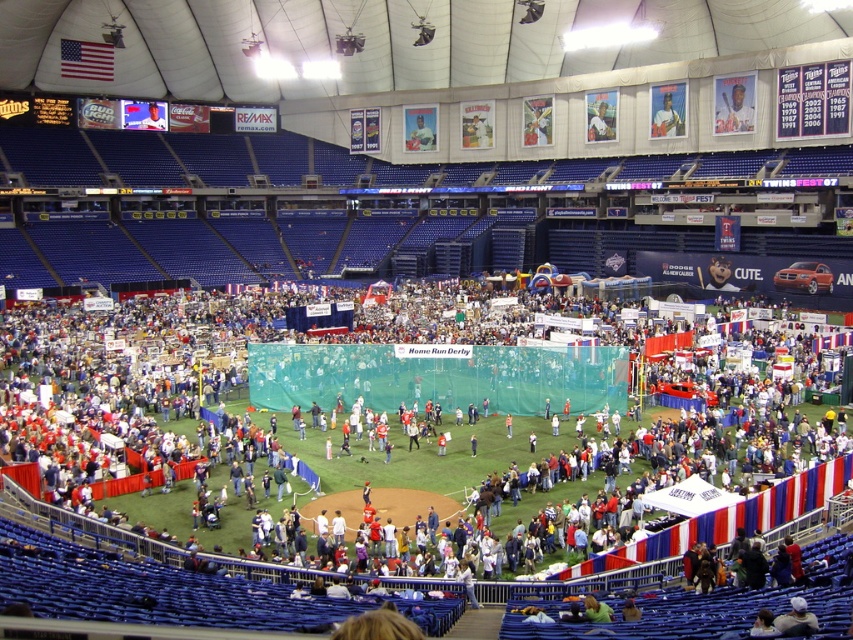
Measure the distance between light blue fabric at upper center and smooth plastic figure at center.

A distance of 28.90 meters exists between light blue fabric at upper center and smooth plastic figure at center.

Locate an element on the screen. light blue fabric at upper center is located at coordinates (665, 120).

You are a GUI agent. You are given a task and a screenshot of the screen. Output one action in this format:
    pyautogui.click(x=<x>, y=<y>)
    Task: Click on the light blue fabric at upper center
    This screenshot has width=853, height=640.
    Given the screenshot: What is the action you would take?
    pyautogui.click(x=665, y=120)